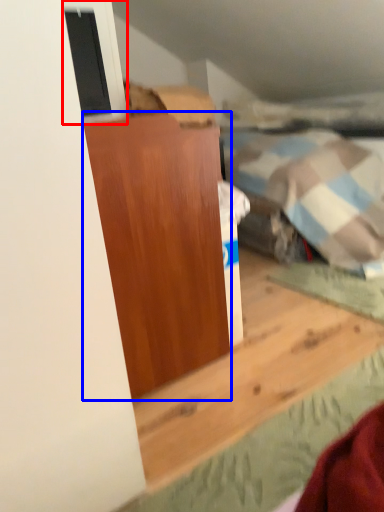
Question: Which point is closer to the camera, window (highlighted by a red box) or furniture (highlighted by a blue box)?

Choices:
 (A) window
 (B) furniture

Answer: (B)